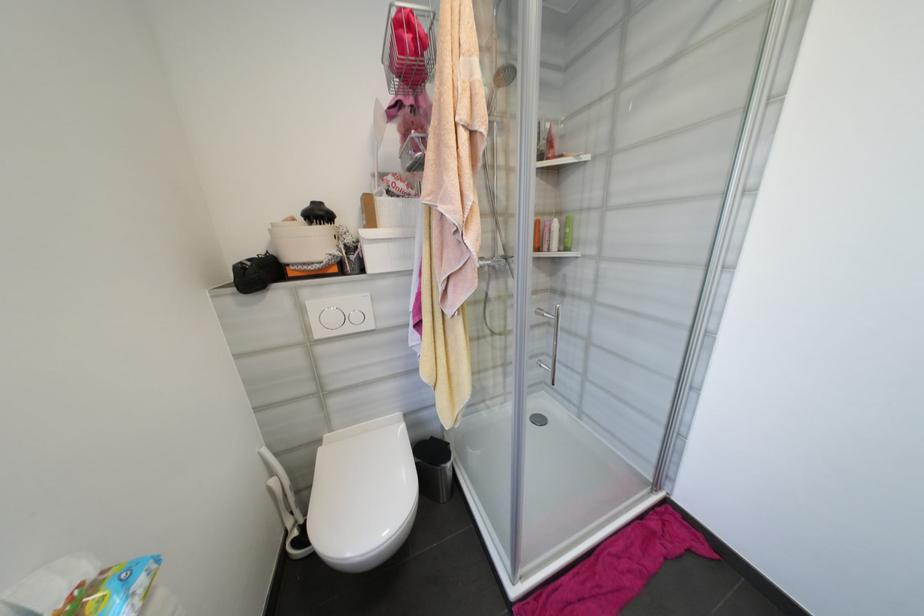
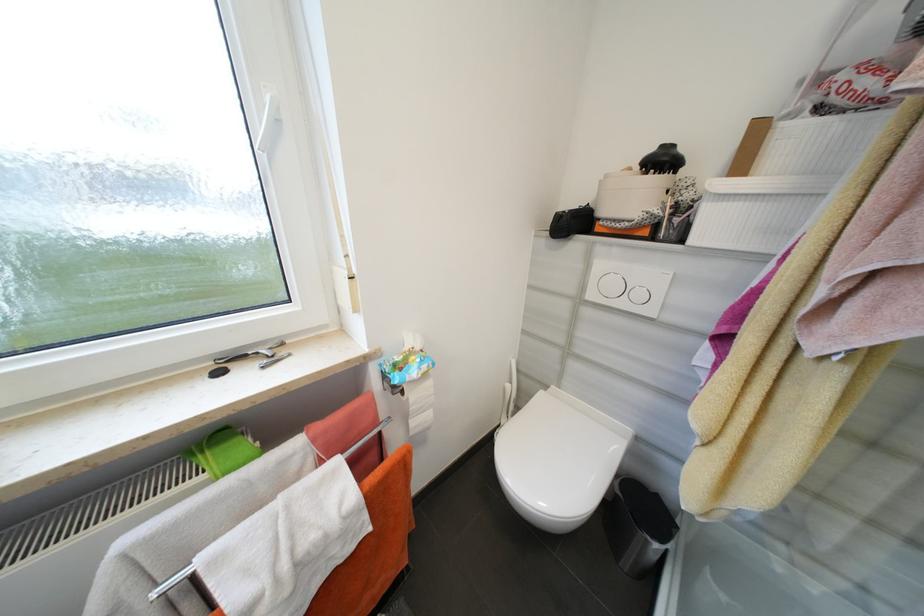
The point at (x=147, y=584) is marked in the first image. Where is the corresponding point in the second image?

(430, 368)